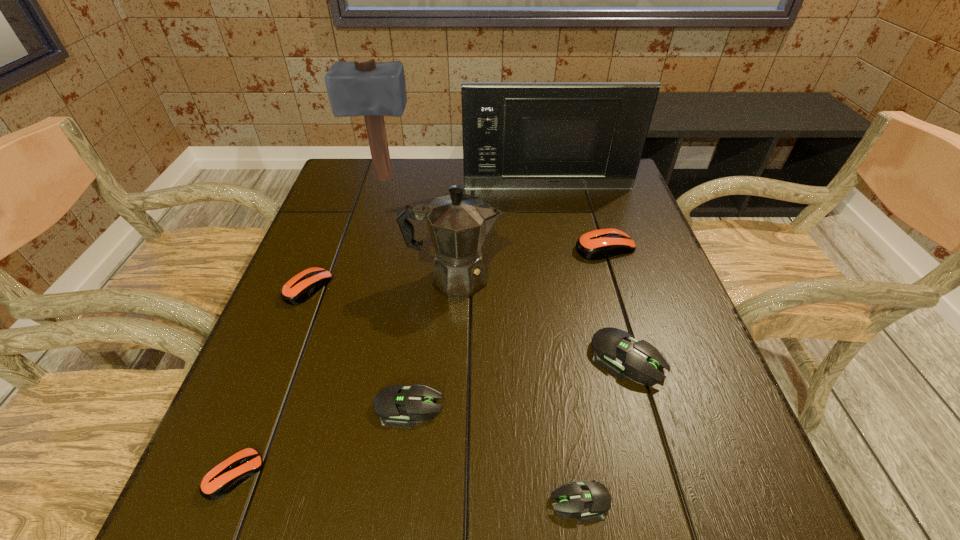
Identify the location of blank space located on the back of the smallest orange computer mouse. (308, 288).

I want to click on vacant space located 0.120m on the left of the second gray computer mouse from left to right, so click(x=469, y=502).

Identify the location of mallet that is at the far edge. This screenshot has height=540, width=960. (364, 88).

Find the location of a particular element. microwave oven located in the far edge section of the desktop is located at coordinates (585, 136).

You are a GUI agent. You are given a task and a screenshot of the screen. Output one action in this format:
    pyautogui.click(x=<x>, y=<y>)
    Task: Click on the mallet present at the left edge
    This screenshot has height=540, width=960.
    Given the screenshot: What is the action you would take?
    pyautogui.click(x=364, y=88)

This screenshot has width=960, height=540. In order to click on microwave oven that is at the right edge in this screenshot , I will do `click(585, 136)`.

Where is `object present at the far left corner`? object present at the far left corner is located at coordinates (364, 88).

I want to click on object located in the near left corner section of the desktop, so click(x=224, y=477).

Locate an element on the screen. The height and width of the screenshot is (540, 960). object positioned at the far right corner is located at coordinates (585, 136).

The width and height of the screenshot is (960, 540). I want to click on vacant space at the far edge of the desktop, so click(x=559, y=195).